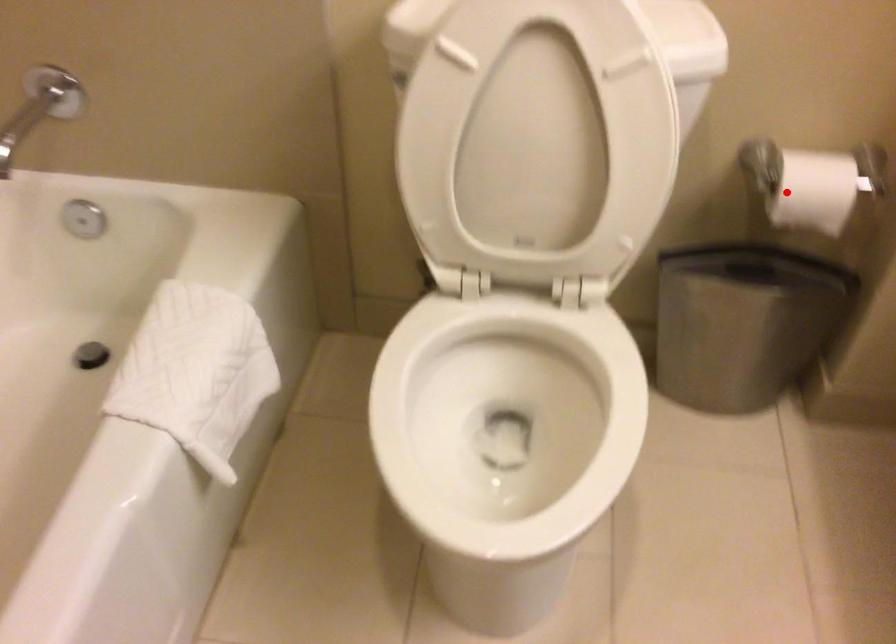
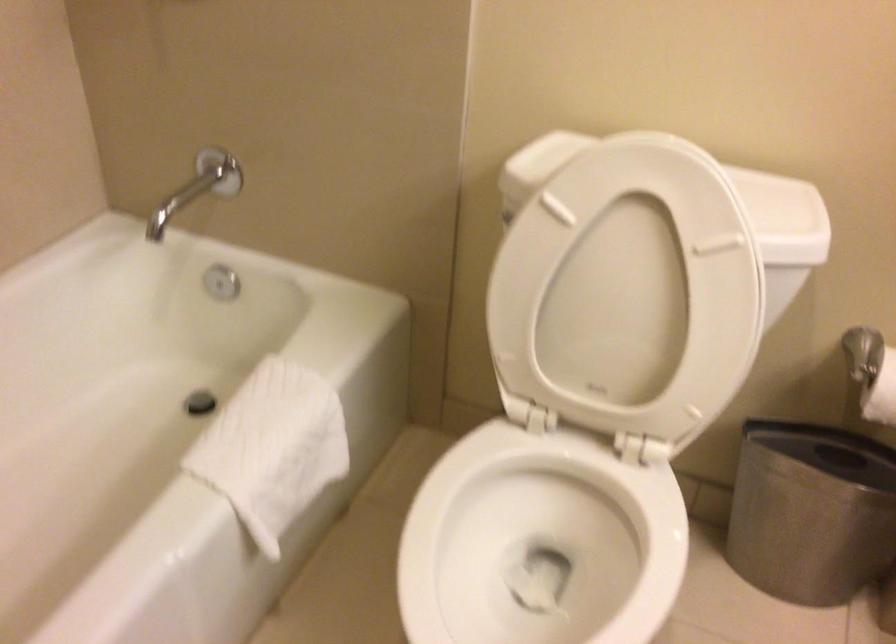
Locate, in the second image, the point that corresponds to the highlighted location in the first image.

(881, 393)